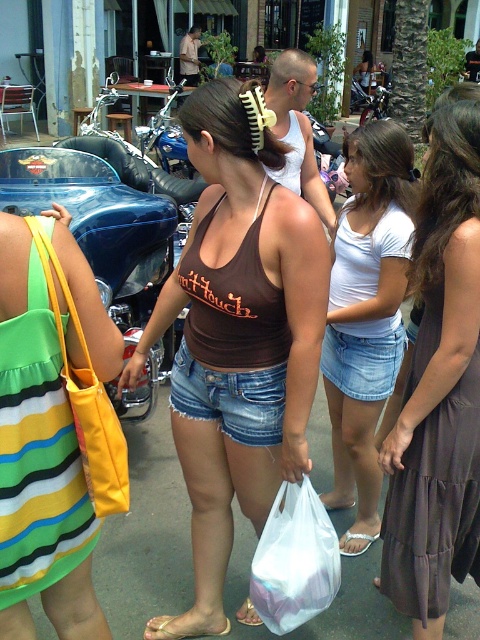
Question: Is brown cotton tank top at center thinner than yellow fabric bag at left?

Choices:
 (A) no
 (B) yes

Answer: (A)

Question: Which is farther from the brown tank top at center?

Choices:
 (A) yellow plastic comb at center
 (B) white glittery sandal at lower center
 (C) brown cotton dress at right

Answer: (B)

Question: Which of the following is the farthest from the observer?

Choices:
 (A) (160, 230)
 (B) (380, 125)
 (C) (444, 611)
 (D) (272, 236)

Answer: (A)

Question: Is brown smooth hair at upper right closer to camera compared to brown leather sandal at lower center?

Choices:
 (A) yes
 (B) no

Answer: (A)

Question: Considering the relative positions of brown tank top at center and tan leather sandal at lower left in the image provided, where is brown tank top at center located with respect to tan leather sandal at lower left?

Choices:
 (A) left
 (B) right

Answer: (B)

Question: Which of the following is the closest to the observer?

Choices:
 (A) (235, 308)
 (B) (178, 394)

Answer: (A)